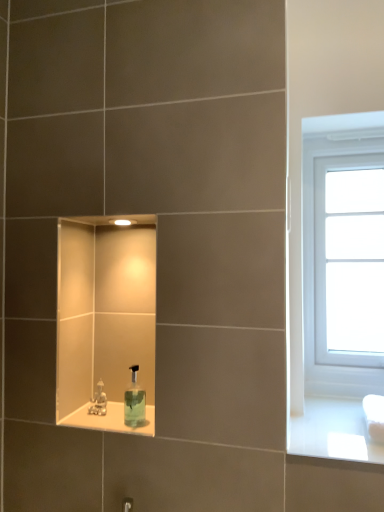
Identify the location of free space in front of metallic silver faucet at lower center. click(99, 428).